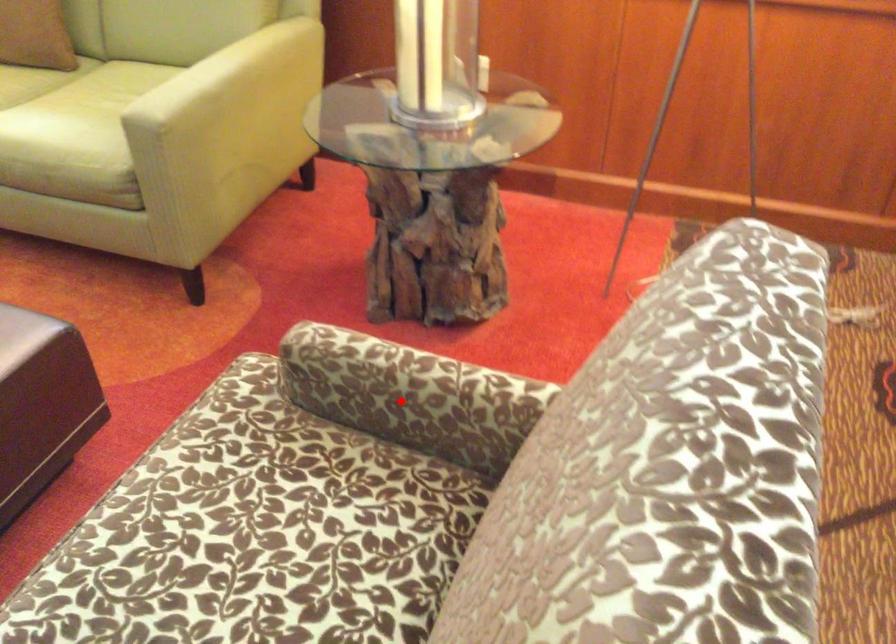
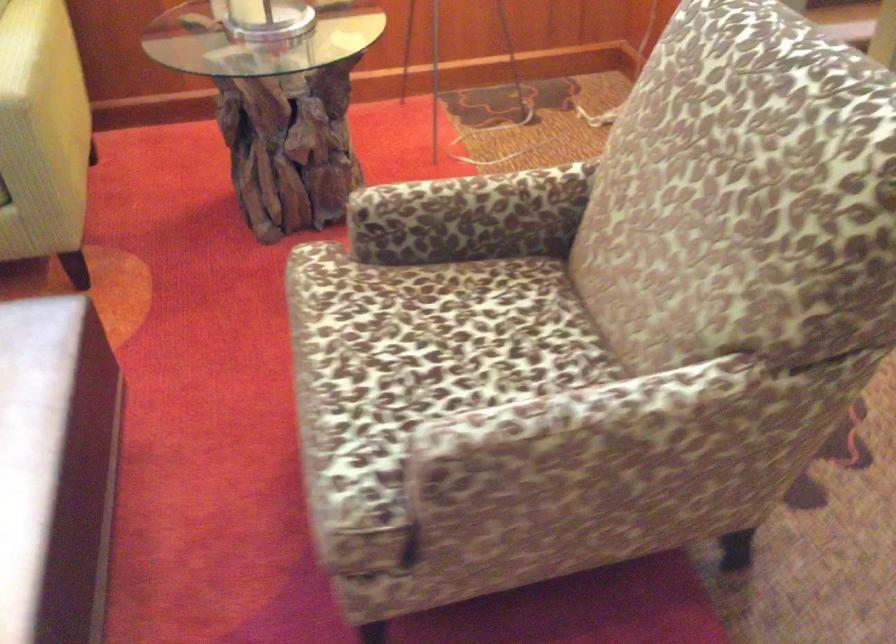
Find the pixel in the second image that matches the highlighted location in the first image.

(471, 216)